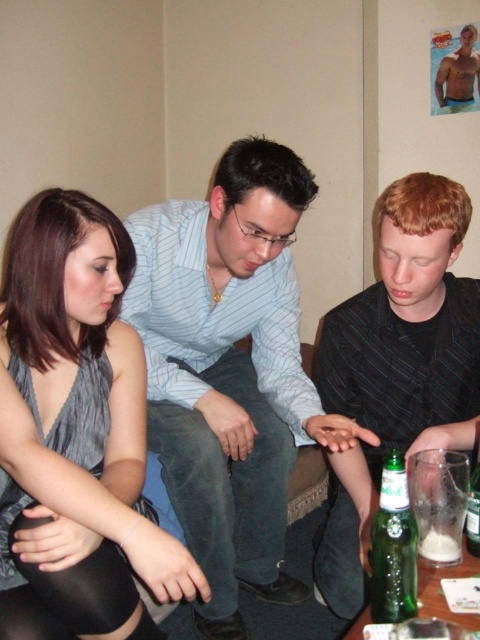
Question: In this image, where is light blue striped shirt at center located relative to muscular tan torso at upper right?

Choices:
 (A) left
 (B) right

Answer: (A)

Question: Among these objects, which one is nearest to the camera?

Choices:
 (A) black striped shirt at lower right
 (B) green glass bottle at lower center
 (C) muscular tan torso at upper right
 (D) green glass bottle at lower right

Answer: (B)

Question: Based on their relative distances, which object is farther from the green glass bottle at lower center?

Choices:
 (A) green glass bottle at lower right
 (B) muscular tan torso at upper right
 (C) gray satin dress at lower left
 (D) light blue striped shirt at center

Answer: (B)

Question: Is light blue striped shirt at center positioned before muscular tan torso at upper right?

Choices:
 (A) no
 (B) yes

Answer: (B)

Question: Which point is farther to the camera?

Choices:
 (A) black striped shirt at lower right
 (B) green glass bottle at lower right
 (C) gray satin dress at lower left
 (D) muscular tan torso at upper right

Answer: (D)

Question: Considering the relative positions of black striped shirt at lower right and muscular tan torso at upper right in the image provided, where is black striped shirt at lower right located with respect to muscular tan torso at upper right?

Choices:
 (A) above
 (B) below

Answer: (B)